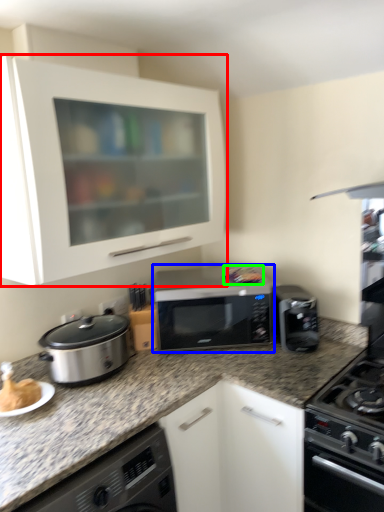
Question: Which object is positioned closest to cabinetry (highlighted by a red box)? Select from microwave oven (highlighted by a blue box) and food (highlighted by a green box).

Choices:
 (A) microwave oven
 (B) food

Answer: (A)